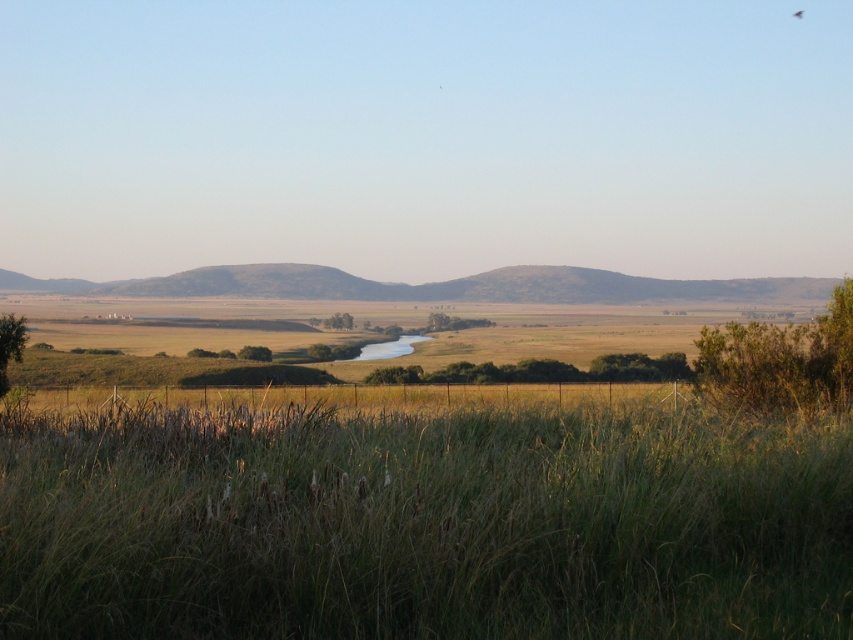
Question: Which point is closer to the camera?

Choices:
 (A) (703, 324)
 (B) (618, 376)
 (C) (416, 538)

Answer: (C)

Question: Which of the following is the farthest from the observer?

Choices:
 (A) green leafy bush at upper right
 (B) green matte tree at center

Answer: (B)

Question: Which point is farther to the camera?

Choices:
 (A) (0, 358)
 (B) (685, 477)
 (C) (753, 388)

Answer: (A)

Question: Can you confirm if green leafy tree at lower left is positioned to the right of green matte tree at center?

Choices:
 (A) no
 (B) yes

Answer: (B)

Question: Does green leafy bush at upper right have a larger size compared to green matte tree at center?

Choices:
 (A) no
 (B) yes

Answer: (A)

Question: Observing the image, what is the correct spatial positioning of green grassy at lower center in reference to green leafy bush at upper right?

Choices:
 (A) above
 (B) below

Answer: (B)